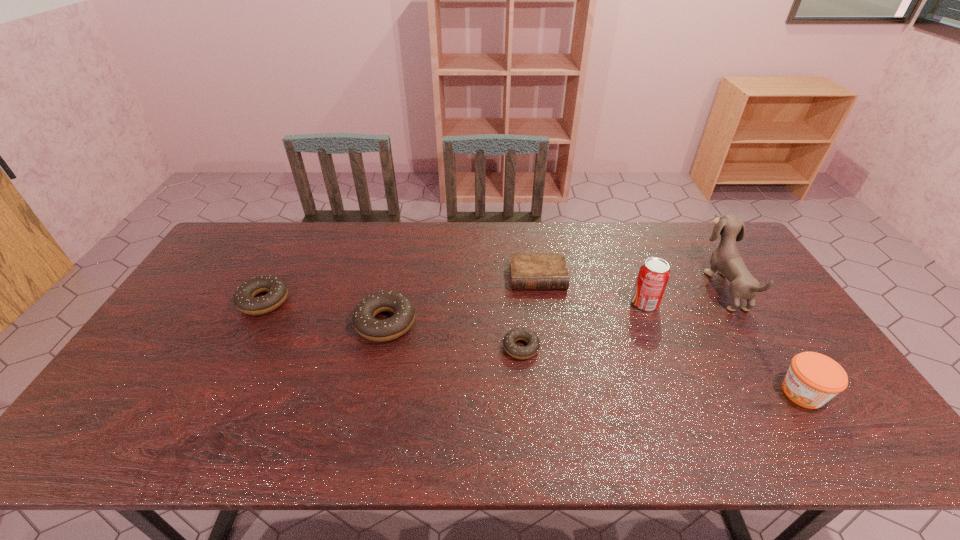
Locate an element on the screen. The image size is (960, 540). the leftmost doughnut is located at coordinates (244, 298).

Locate an element on the screen. the second shortest doughnut is located at coordinates (244, 298).

Identify the location of the second doughnut from left to right. pos(366,325).

Identify the location of the rightmost doughnut. The width and height of the screenshot is (960, 540). click(x=533, y=343).

Where is `the shortest doughnut`? The image size is (960, 540). the shortest doughnut is located at coordinates (533, 343).

You are a GUI agent. You are given a task and a screenshot of the screen. Output one action in this format:
    pyautogui.click(x=<x>, y=<y>)
    Task: Click on the diary
    This screenshot has height=540, width=960.
    Given the screenshot: What is the action you would take?
    pyautogui.click(x=528, y=270)

Find the location of a particular element. The image size is (960, 540). the tallest object is located at coordinates (726, 259).

Find the location of a particular element. soda can is located at coordinates (654, 273).

Locate an element on the screen. the third object from right to left is located at coordinates (654, 273).

Identify the location of jam. (813, 379).